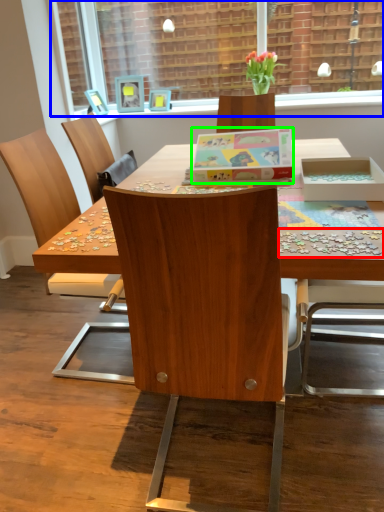
Question: Considering the real-world distances, which object is closest to jigsaw puzzle (highlighted by a red box)? window screen (highlighted by a blue box) or box (highlighted by a green box).

Choices:
 (A) window screen
 (B) box

Answer: (B)